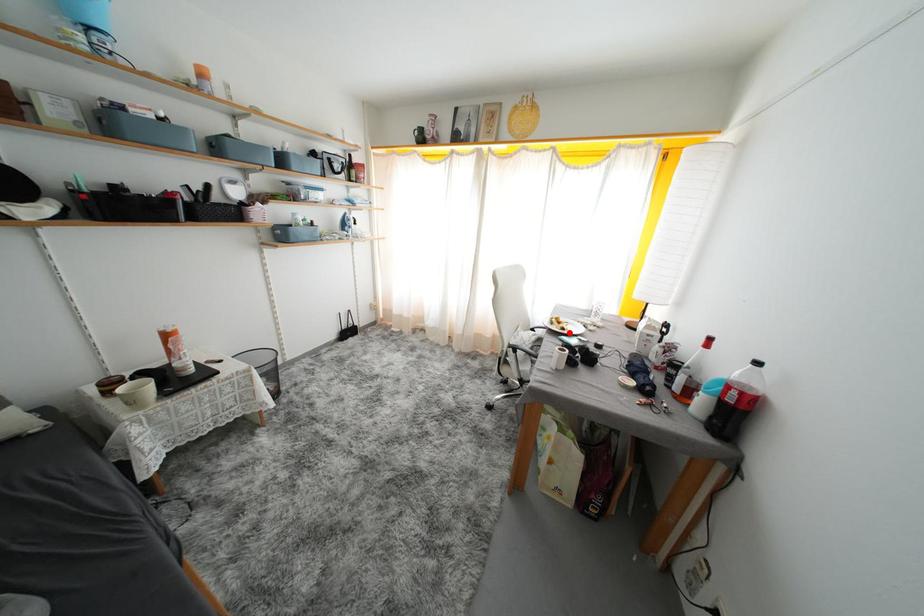
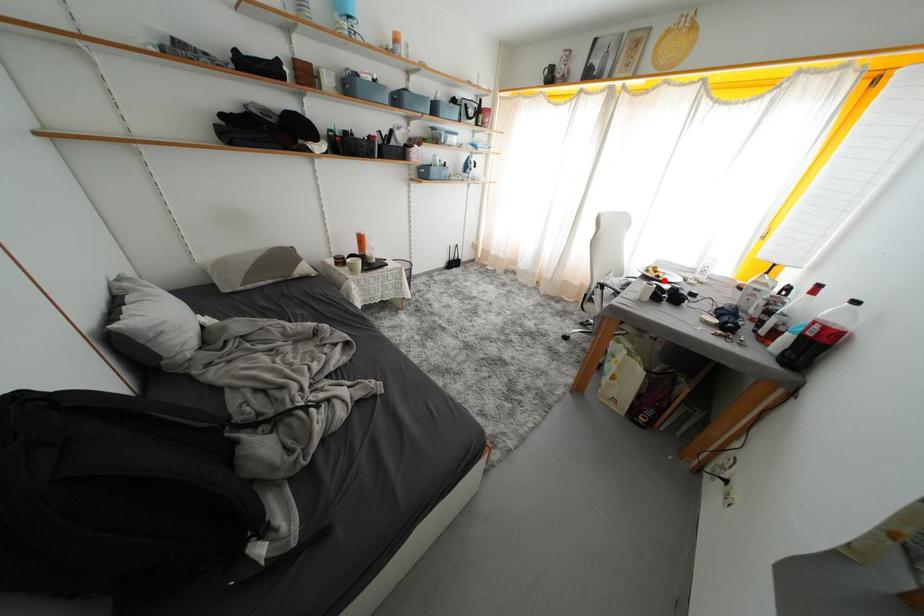
I am providing you with two images of the same scene from different viewpoints. A red point is marked on the first image and another point is marked on the second image. Does the point marked in image1 correspond to the same location as the one in image2?

Yes